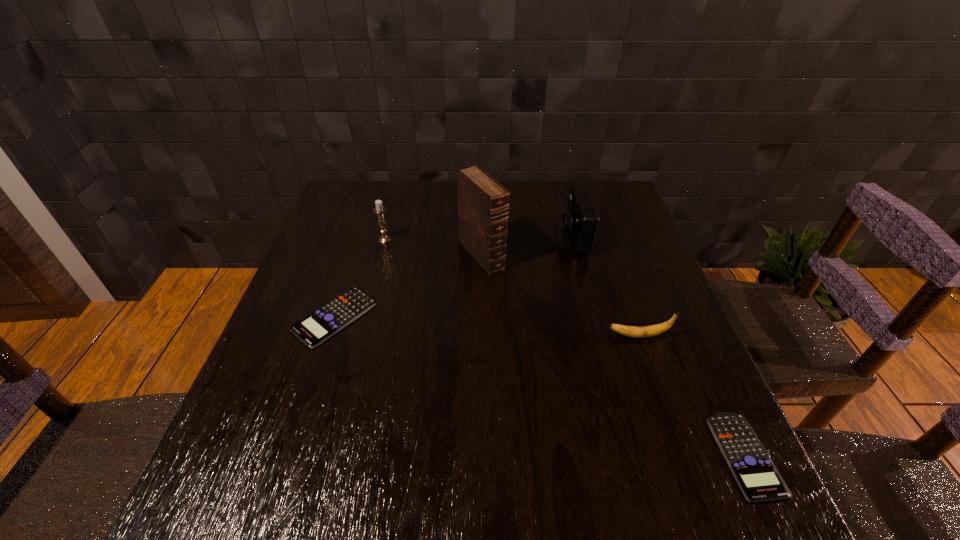
Find the location of a particular element. The image size is (960, 540). free location at the right edge of the desktop is located at coordinates (x=620, y=268).

The width and height of the screenshot is (960, 540). Find the location of `free spot at the near left corner of the desktop`. free spot at the near left corner of the desktop is located at coordinates (247, 443).

I want to click on vacant space at the near right corner of the desktop, so click(x=684, y=422).

You are a GUI agent. You are given a task and a screenshot of the screen. Output one action in this format:
    pyautogui.click(x=<x>, y=<y>)
    Task: Click on the unoccupied area between the candle holder and the tallest object
    
    Given the screenshot: What is the action you would take?
    pyautogui.click(x=433, y=247)

Locate an element on the screen. This screenshot has height=540, width=960. free space between the banana and the farther calculator is located at coordinates (486, 327).

Locate an element on the screen. This screenshot has width=960, height=540. free space between the fourth tallest object and the tallest object is located at coordinates [560, 296].

In order to click on unoccupied area between the second shortest object and the nearer calculator in this screenshot , I will do `click(540, 386)`.

Identify the location of vacant space that's between the camera and the tallest object. This screenshot has height=540, width=960. (527, 246).

Find the location of a particular element. unoccupied position between the candle holder and the left calculator is located at coordinates (360, 279).

At what (x,y) coordinates should I click in order to perform the action: click on free spot between the banana and the fifth tallest object. Please return your answer as a coordinate pair (x, y). The height and width of the screenshot is (540, 960). Looking at the image, I should click on click(x=486, y=327).